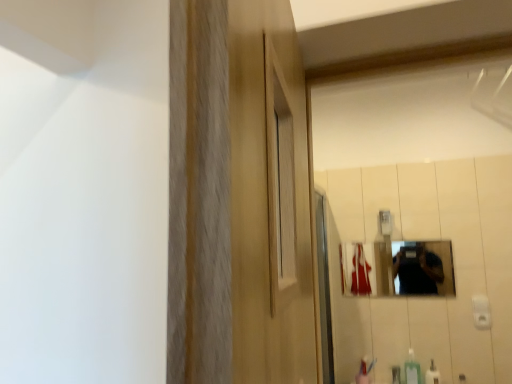
Question: Considering the positions of metallic reflective mirror at center and white glossy bottle at lower right in the image, is metallic reflective mirror at center bigger or smaller than white glossy bottle at lower right?

Choices:
 (A) big
 (B) small

Answer: (A)

Question: Considering the positions of metallic reflective mirror at center and white glossy bottle at lower right in the image, is metallic reflective mirror at center wider or thinner than white glossy bottle at lower right?

Choices:
 (A) thin
 (B) wide

Answer: (A)

Question: Estimate the real-world distances between objects in this image. Which object is farther from the green plastic soap dispenser at lower right?

Choices:
 (A) white glossy bottle at lower right
 (B) metallic reflective mirror at center

Answer: (B)

Question: Which object is the farthest from the green plastic soap dispenser at lower right?

Choices:
 (A) metallic reflective mirror at center
 (B) white glossy bottle at lower right

Answer: (A)